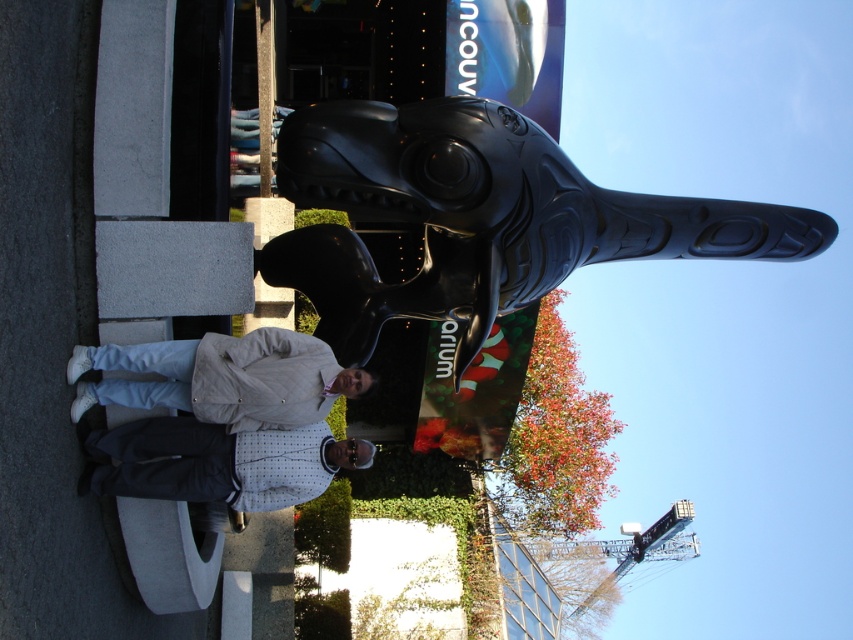
You are a photographer trying to capture a photo of the black polished whale at center and the beige fabric jacket at lower center. Which object should you focus on first if you want to ensure both are in sharp focus?

The black polished whale at center is larger in size than the beige fabric jacket at lower center, so you should focus on the larger object first to ensure both are in sharp focus.

Based on the photo, you are a photographer trying to capture a photo of the black polished whale at center and the beige fabric jacket at lower center. The minimum distance required between the camera and the subject for clear focus is 20 feet. Can you take a photo of both subjects clearly without moving the camera or the subjects?

The black polished whale at center and beige fabric jacket at lower center are 25.52 feet apart. Since the minimum focus distance is 20 feet, and the distance between them is greater than that, you can capture both subjects clearly in the photo.